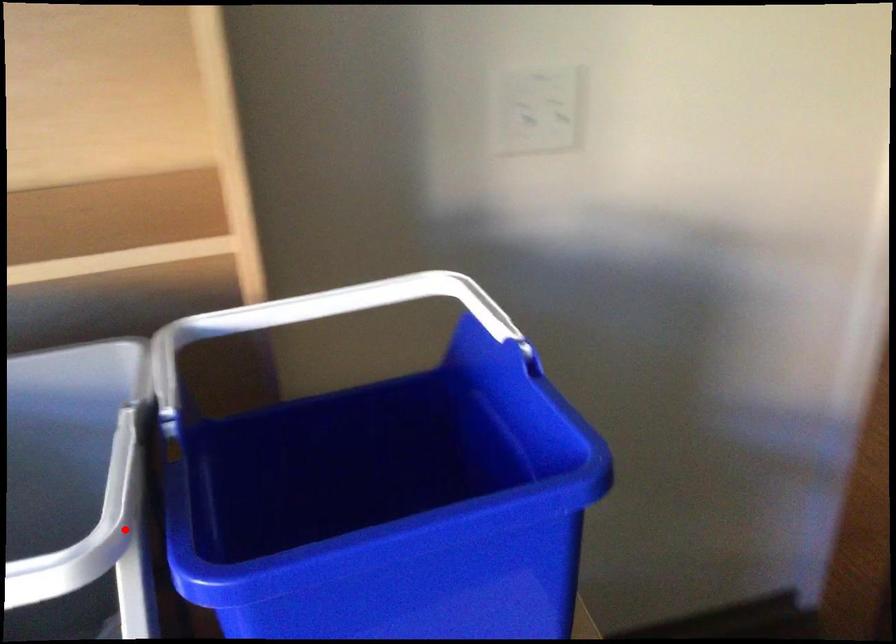
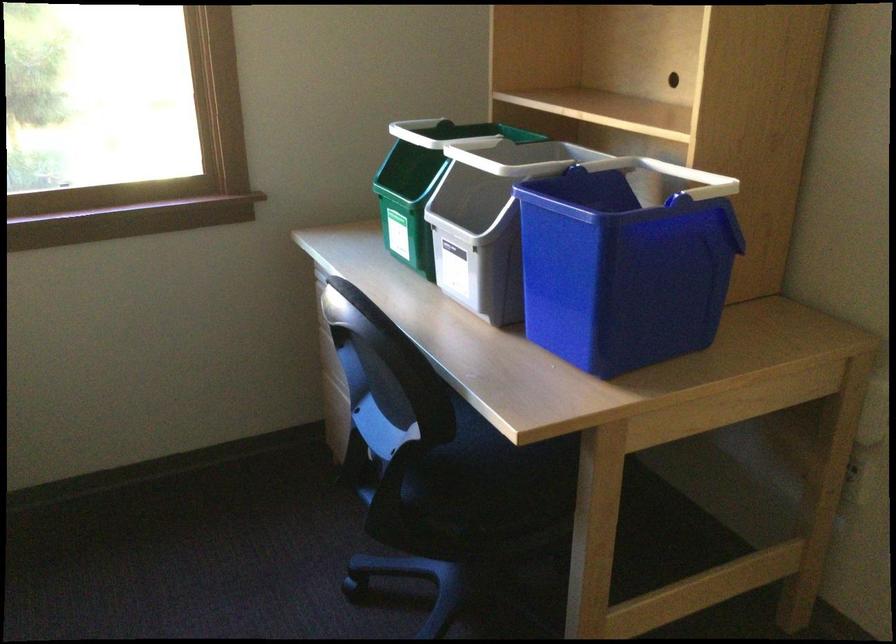
Question: I am providing you with two images of the same scene from different viewpoints. A red point is marked on the first image. At the location where the point appears in image 1, is it still visible in image 2?

Choices:
 (A) Yes
 (B) No

Answer: (B)